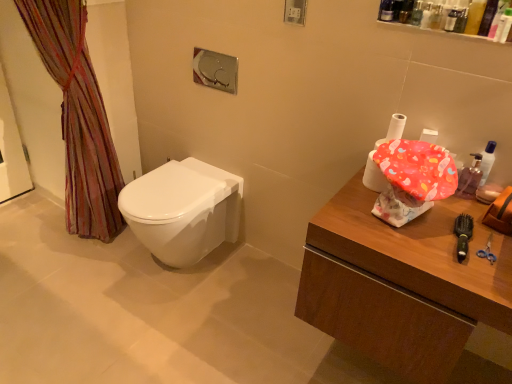
Identify the location of free point in front of matte pink fabric toilet paper at right. (384, 219).